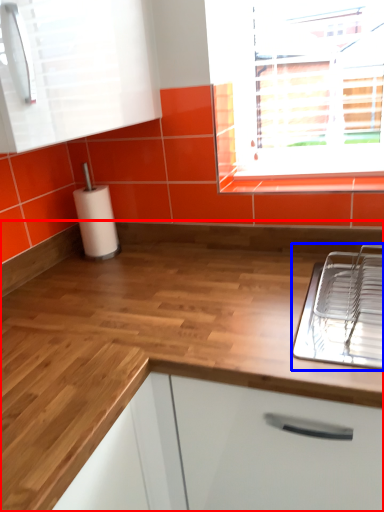
Question: Which object appears closest to the camera in this image, countertop (highlighted by a red box) or appliance (highlighted by a blue box)?

Choices:
 (A) countertop
 (B) appliance

Answer: (A)